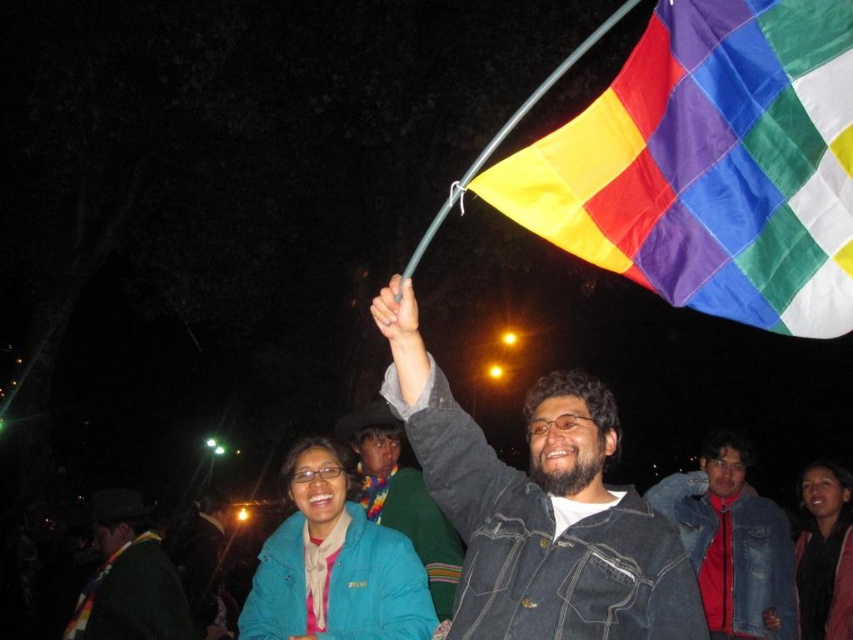
Where is `polyester rainbow flag at upper right`? Image resolution: width=853 pixels, height=640 pixels. polyester rainbow flag at upper right is located at coordinates (711, 164).

Identify the location of polyester rainbow flag at upper right. The image size is (853, 640). (711, 164).

Does green wool scarf at lower left come behind blue denim jacket at lower center?

No, green wool scarf at lower left is in front of blue denim jacket at lower center.

Can you confirm if green wool scarf at lower left is positioned above blue denim jacket at lower center?

Yes, green wool scarf at lower left is above blue denim jacket at lower center.

What do you see at coordinates (129, 579) in the screenshot?
I see `green wool scarf at lower left` at bounding box center [129, 579].

At what (x,y) coordinates should I click in order to perform the action: click on green wool scarf at lower left. Please return your answer as a coordinate pair (x, y). Looking at the image, I should click on (129, 579).

Is point (137, 516) farther from viewer compared to point (824, 616)?

No, it is not.

Measure the distance between green wool scarf at lower left and blue fleece jacket at lower right.

A distance of 5.84 meters exists between green wool scarf at lower left and blue fleece jacket at lower right.

You are a GUI agent. You are given a task and a screenshot of the screen. Output one action in this format:
    pyautogui.click(x=<x>, y=<y>)
    Task: Click on the green wool scarf at lower left
    This screenshot has width=853, height=640.
    Given the screenshot: What is the action you would take?
    coord(129,579)